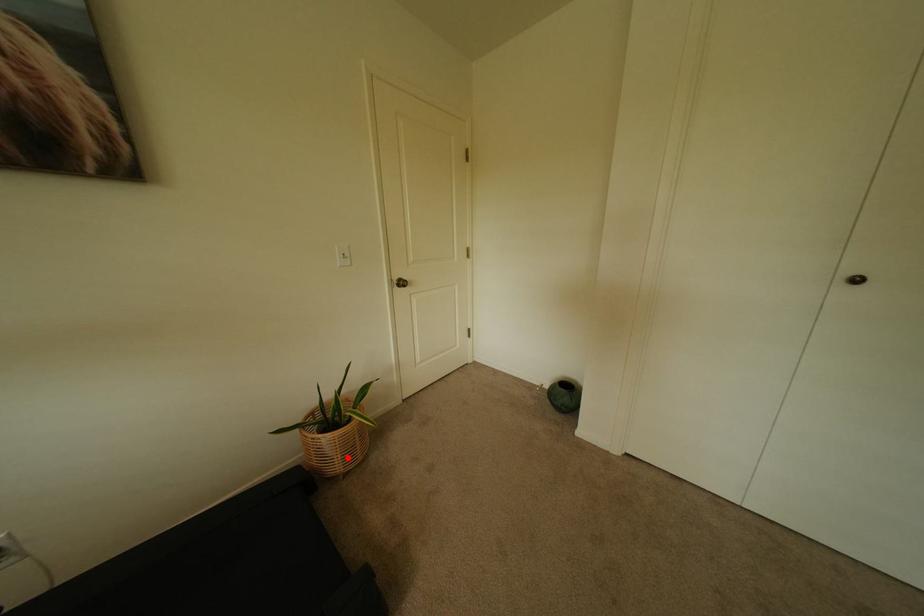
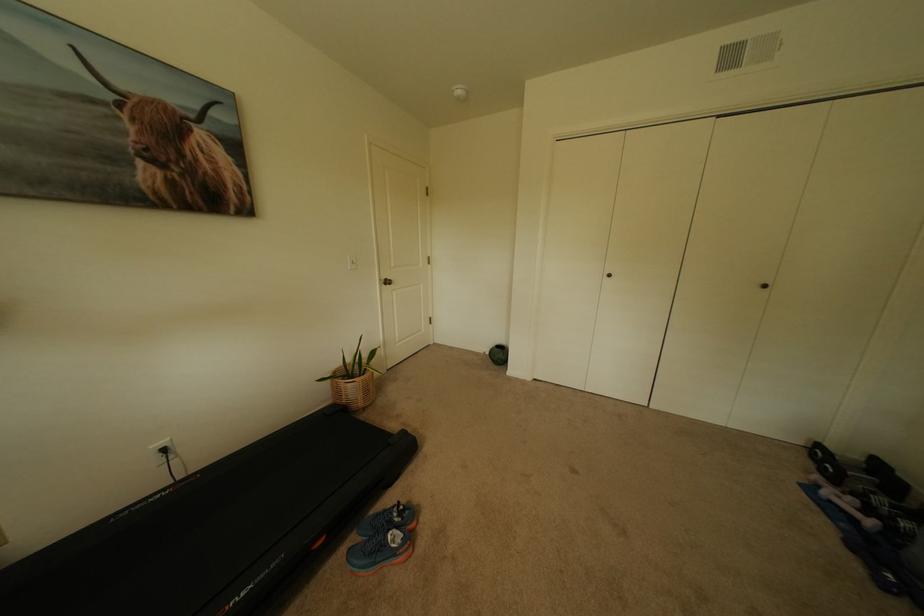
The point at the highlighted location is marked in the first image. Where is the corresponding point in the second image?

(370, 395)